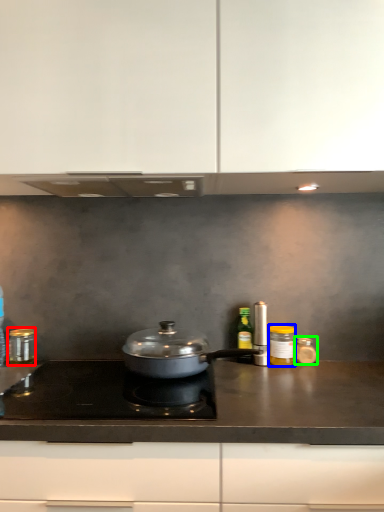
Question: Which object is the farthest from kitchen appliance (highlighted by a red box)? Choose among these: kitchen appliance (highlighted by a blue box) or kitchen appliance (highlighted by a green box).

Choices:
 (A) kitchen appliance
 (B) kitchen appliance

Answer: (B)